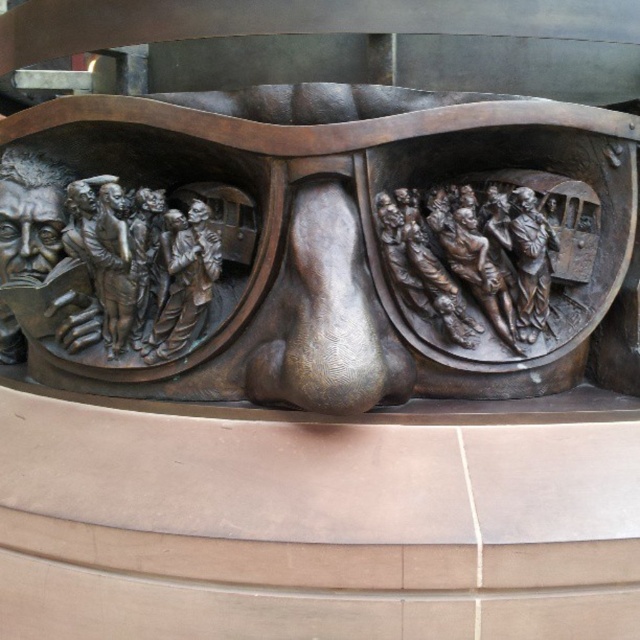
Can you confirm if bronze sculpture at center is positioned to the left of bronze relief figures at right?

Yes, bronze sculpture at center is to the left of bronze relief figures at right.

Which of these two, bronze sculpture at center or bronze relief figures at right, stands taller?

Standing taller between the two is bronze sculpture at center.

Who is more forward, (90, 262) or (538, 330)?

Point (538, 330)

Identify the location of bronze sculpture at center. (314, 243).